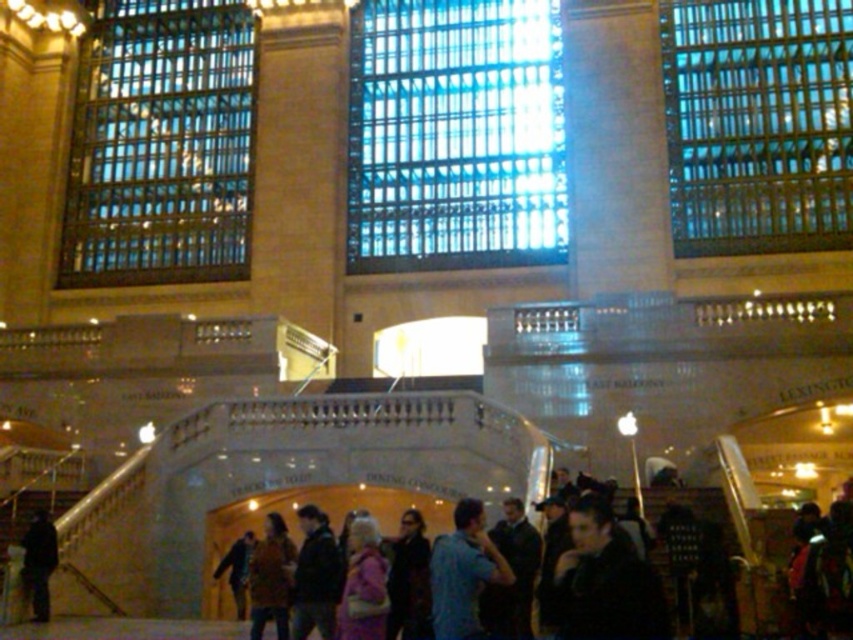
Question: Which of these objects is positioned farthest from the dark hair at lower right?

Choices:
 (A) dark blue jacket at lower left
 (B) dark brown leather jacket at center
 (C) brown fuzzy coat at center
 (D) blue cotton shirt at center

Answer: (A)

Question: Which object appears farthest from the camera in this image?

Choices:
 (A) pink fabric jacket at center
 (B) brown fuzzy coat at center
 (C) dark sunglasses at center

Answer: (B)

Question: Does dark hair at lower right appear under dark brown leather jacket at center?

Choices:
 (A) yes
 (B) no

Answer: (B)

Question: Can you confirm if dark hair at lower right is positioned above dark blue jacket at lower left?

Choices:
 (A) no
 (B) yes

Answer: (B)

Question: Estimate the real-world distances between objects in this image. Which object is closer to the dark sunglasses at center?

Choices:
 (A) dark blue jacket at lower left
 (B) pink fabric jacket at center

Answer: (B)

Question: Can you confirm if dark hair at lower right is positioned above brown fuzzy coat at center?

Choices:
 (A) yes
 (B) no

Answer: (A)